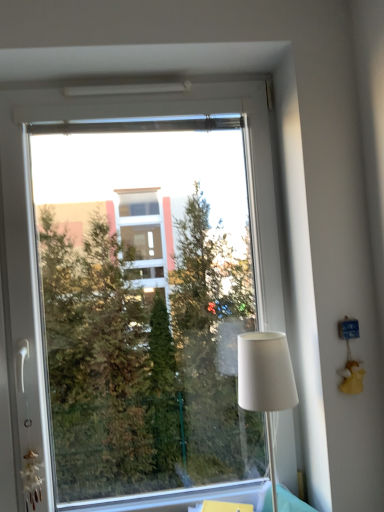
Question: Does point (281, 336) appear closer or farther from the camera than point (110, 202)?

Choices:
 (A) closer
 (B) farther

Answer: (A)

Question: Is white fabric lampshade at right wider or thinner than transparent glass window at center?

Choices:
 (A) wide
 (B) thin

Answer: (A)

Question: In the image, is white fabric lampshade at right positioned in front of or behind transparent glass window at center?

Choices:
 (A) behind
 (B) front

Answer: (B)

Question: In terms of height, does transparent glass window at center look taller or shorter compared to white fabric lampshade at right?

Choices:
 (A) short
 (B) tall

Answer: (B)

Question: Considering the relative positions of transparent glass window at center and white fabric lampshade at right in the image provided, is transparent glass window at center to the left or to the right of white fabric lampshade at right?

Choices:
 (A) left
 (B) right

Answer: (A)

Question: Is point (218, 461) closer or farther from the camera than point (254, 358)?

Choices:
 (A) farther
 (B) closer

Answer: (A)

Question: From the image's perspective, is transparent glass window at center positioned above or below white fabric lampshade at right?

Choices:
 (A) below
 (B) above

Answer: (B)